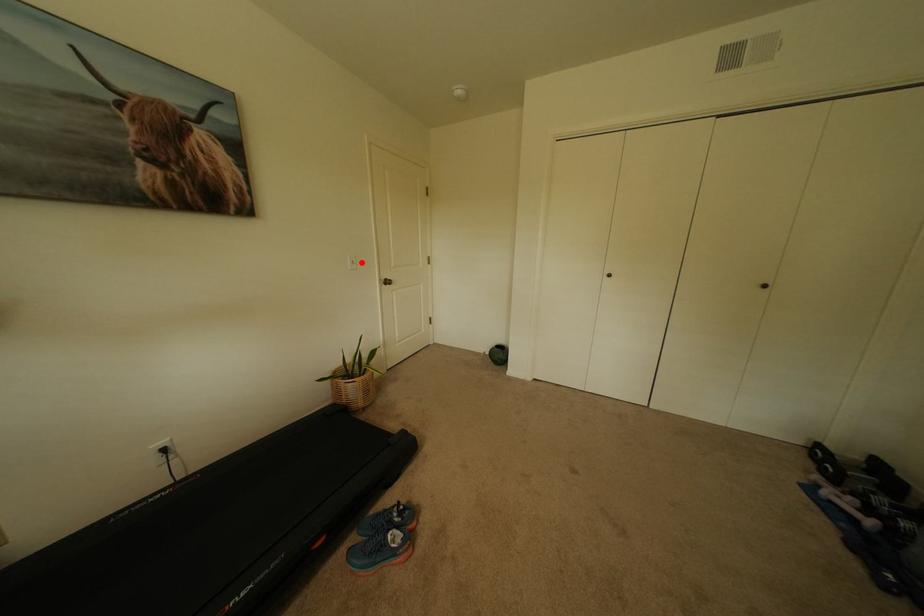
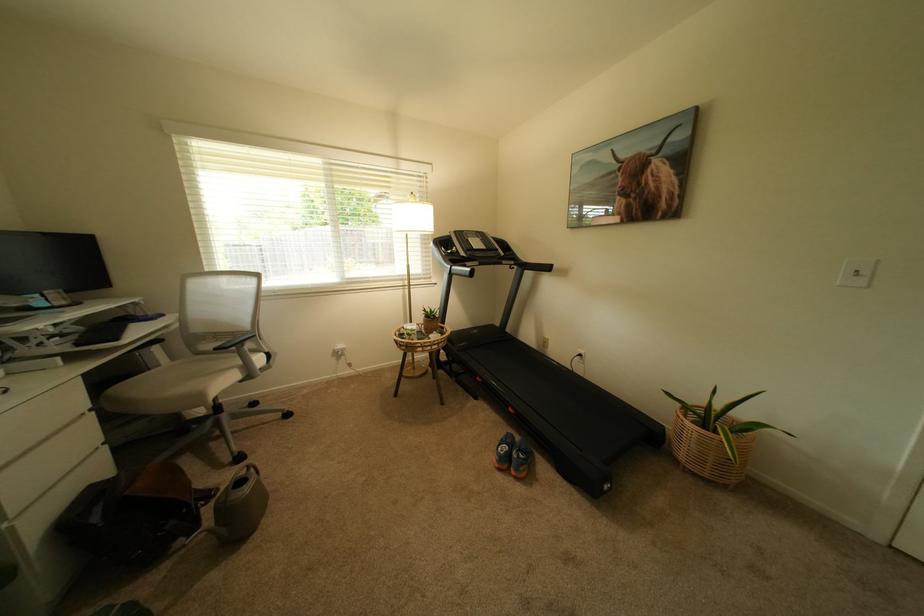
Question: I am providing you with two images of the same scene from different viewpoints. In image1, a red point is highlighted. Considering the same 3D point in image2, which of the following is correct?

Choices:
 (A) It is closer
 (B) It is farther

Answer: (B)